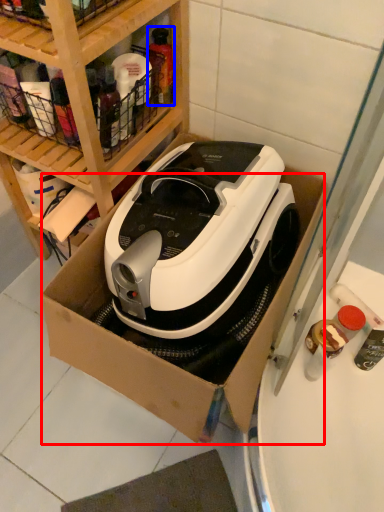
Question: Which point is further to the camera, cardboard box (highlighted by a red box) or bottle (highlighted by a blue box)?

Choices:
 (A) cardboard box
 (B) bottle

Answer: (B)